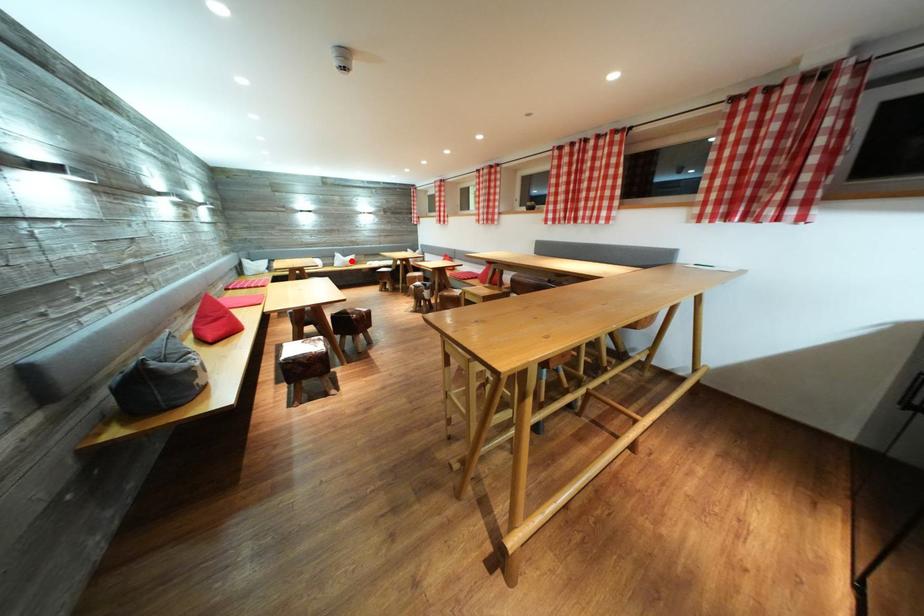
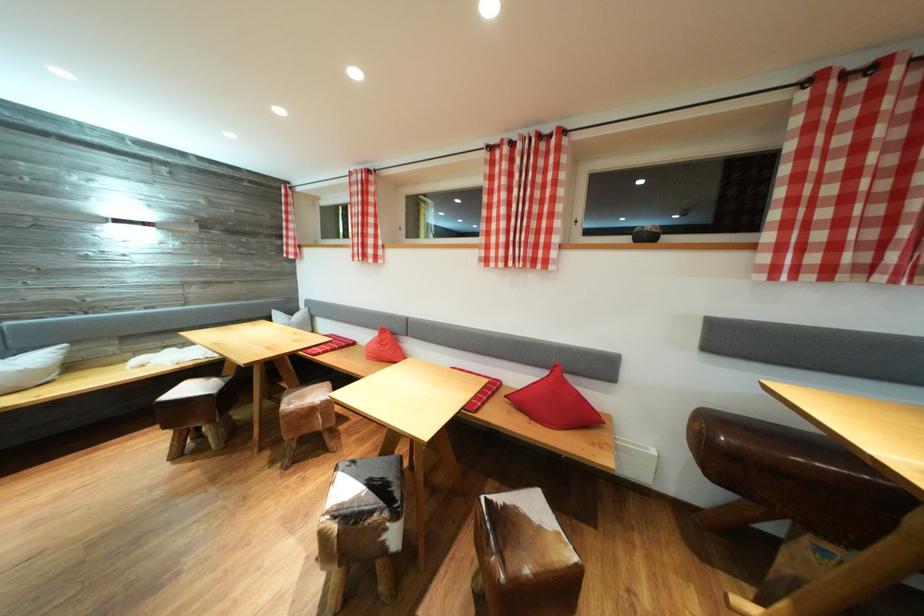
Question: I am providing you with two images of the same scene from different viewpoints. Image1 has a red point marked. In image2, the corresponding 3D location appears at what relative position? Reply with the corresponding letter.

Choices:
 (A) Closer
 (B) Farther

Answer: (B)